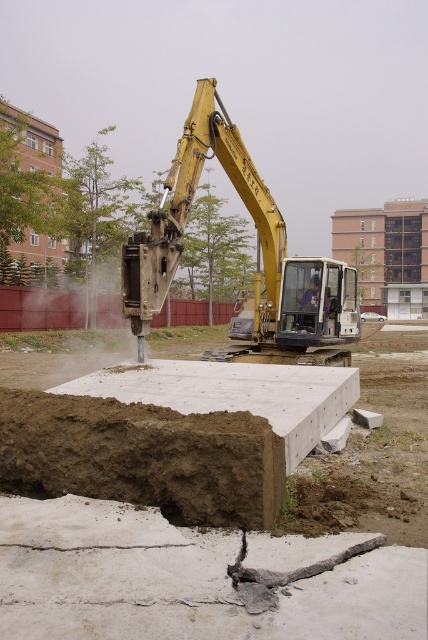
Question: Observing the image, what is the correct spatial positioning of white cracked concrete at center in reference to yellow metallic excavator at center?

Choices:
 (A) left
 (B) right

Answer: (B)

Question: Can you confirm if white cracked concrete at center is wider than light blue fabric construction worker at center?

Choices:
 (A) yes
 (B) no

Answer: (A)

Question: Does brown clay dirt at center have a smaller size compared to light blue fabric construction worker at center?

Choices:
 (A) yes
 (B) no

Answer: (B)

Question: Which point is farther to the camera?

Choices:
 (A) (415, 564)
 (B) (309, 294)
 (C) (282, 228)

Answer: (C)

Question: Based on their relative distances, which object is farther from the white cracked concrete at center?

Choices:
 (A) light blue fabric construction worker at center
 (B) yellow metallic excavator at center

Answer: (A)

Question: Which object is the farthest from the white cracked concrete at center?

Choices:
 (A) yellow metallic excavator at center
 (B) light blue fabric construction worker at center

Answer: (B)